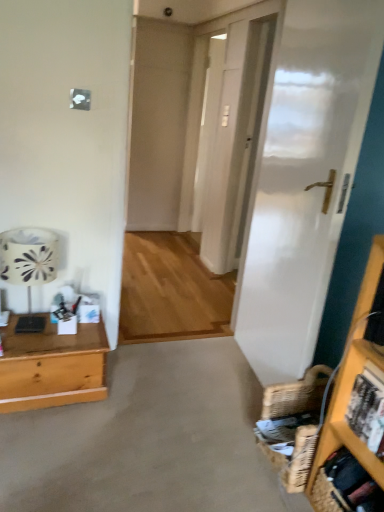
Locate an element on the screen. The width and height of the screenshot is (384, 512). vacant region to the left of woven brown basket at lower right is located at coordinates (235, 460).